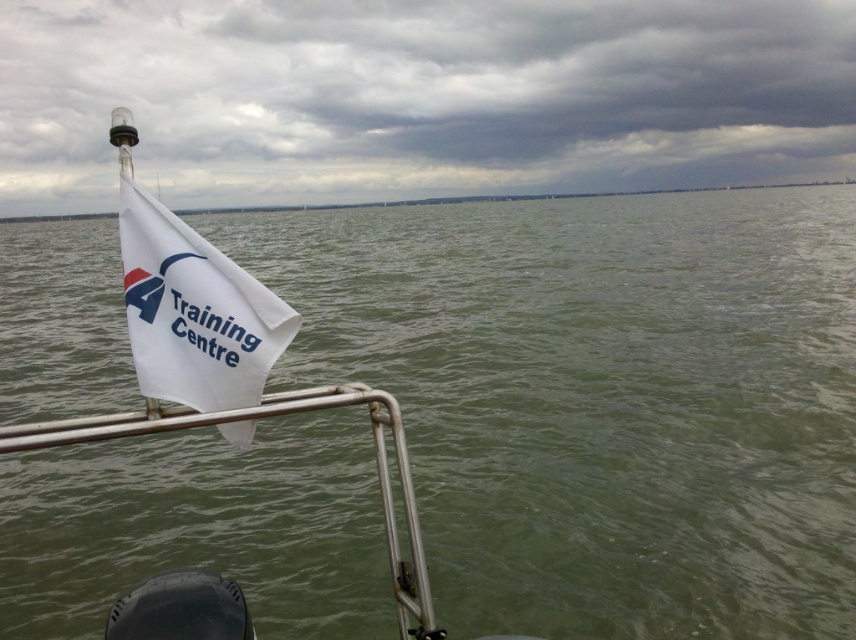
Who is higher up, green water at center or white fabric flag at left?

green water at center is higher up.

Which of these two, green water at center or white fabric flag at left, stands shorter?

white fabric flag at left

You are a GUI agent. You are given a task and a screenshot of the screen. Output one action in this format:
    pyautogui.click(x=<x>, y=<y>)
    Task: Click on the green water at center
    
    Given the screenshot: What is the action you would take?
    [599, 397]

How much distance is there between white flag at left and white fabric flag at left?

white flag at left and white fabric flag at left are 265.30 feet apart.

Which is behind, point (710, 173) or point (229, 276)?

The point (710, 173) is behind.

Is point (431, 19) less distant than point (256, 385)?

No.

This screenshot has height=640, width=856. What are the coordinates of `white flag at left` in the screenshot? It's located at (419, 97).

Identify the location of green water at center. (599, 397).

Does green water at center appear on the left side of white flag at left?

Incorrect, green water at center is not on the left side of white flag at left.

Between point (524, 312) and point (209, 200), which one is positioned behind?

Point (209, 200)

Identify the location of green water at center. (599, 397).